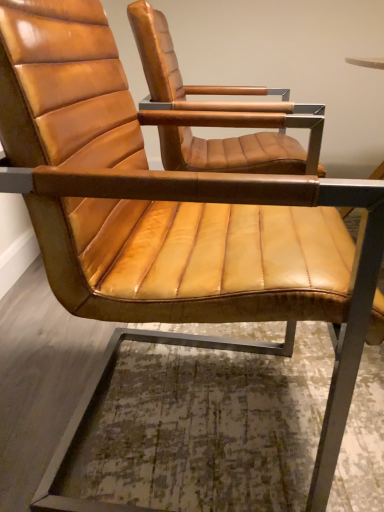
Describe the element at coordinates (240, 152) in the screenshot. The width and height of the screenshot is (384, 512). I see `matte brown leather chair at center` at that location.

Measure the distance between point [193,106] and camera.

1.03 meters.

What are the coordinates of `matte brown leather chair at center` in the screenshot? It's located at (240, 152).

You are a GUI agent. You are given a task and a screenshot of the screen. Output one action in this format:
    pyautogui.click(x=<x>, y=<y>)
    Task: Click on the matte brown leather chair at center
    The width and height of the screenshot is (384, 512).
    Given the screenshot: What is the action you would take?
    pyautogui.click(x=240, y=152)